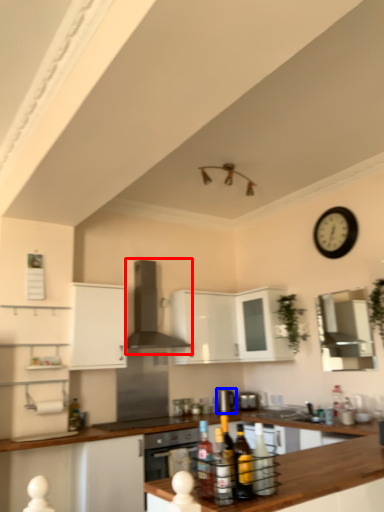
Question: Which of the following is the farthest to the observer, exhaust hood (highlighted by a red box) or appliance (highlighted by a blue box)?

Choices:
 (A) exhaust hood
 (B) appliance

Answer: (B)